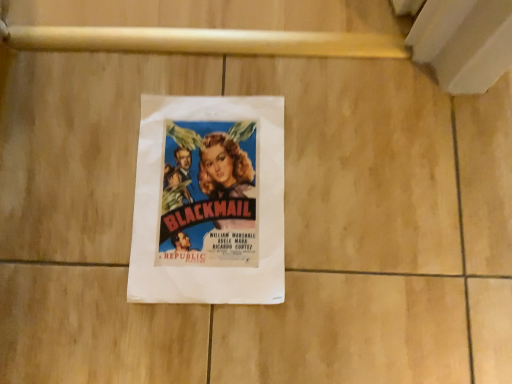
Image resolution: width=512 pixels, height=384 pixels. I want to click on free space above matte paper poster at center (from a real-world perspective), so click(x=213, y=191).